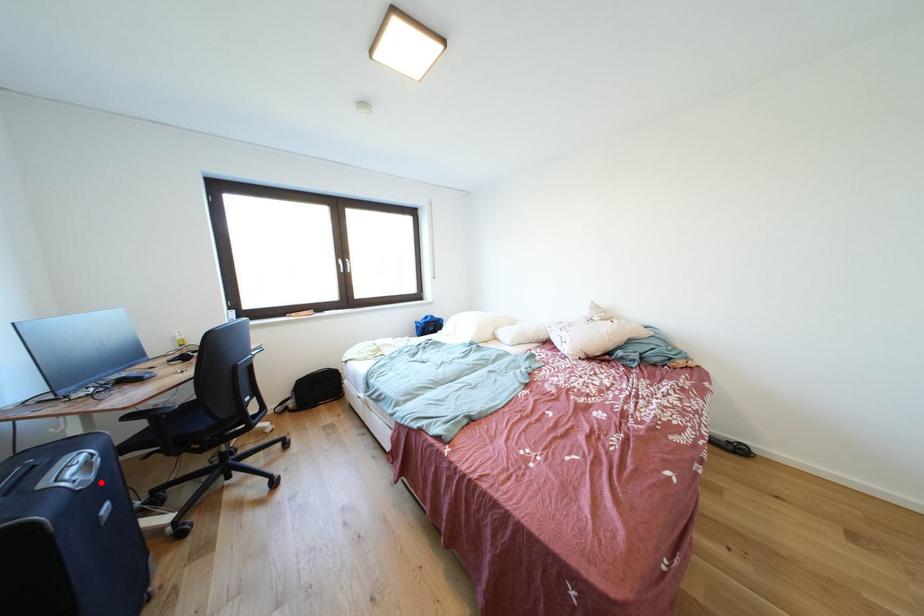
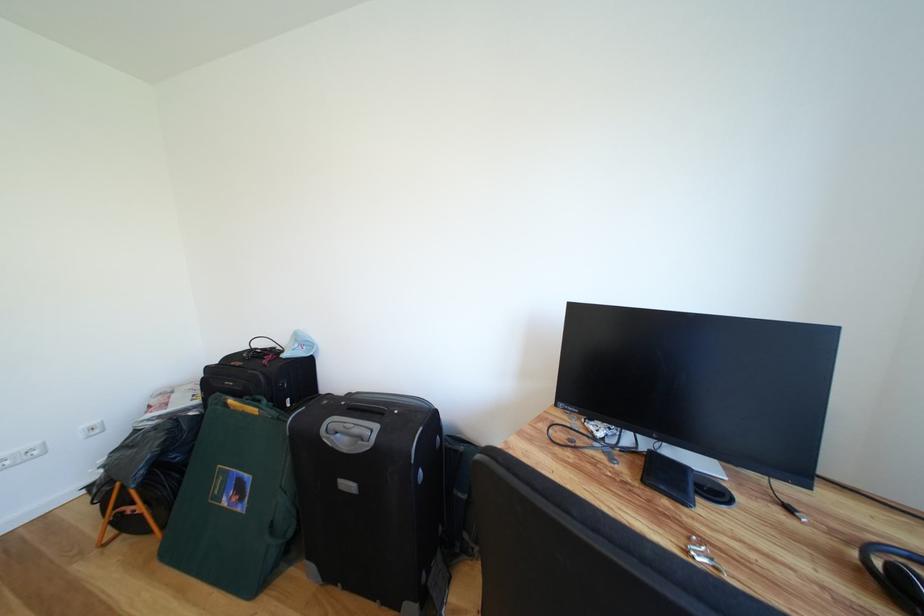
Locate, in the second image, the point that corresponds to the highlighted location in the first image.

(353, 455)